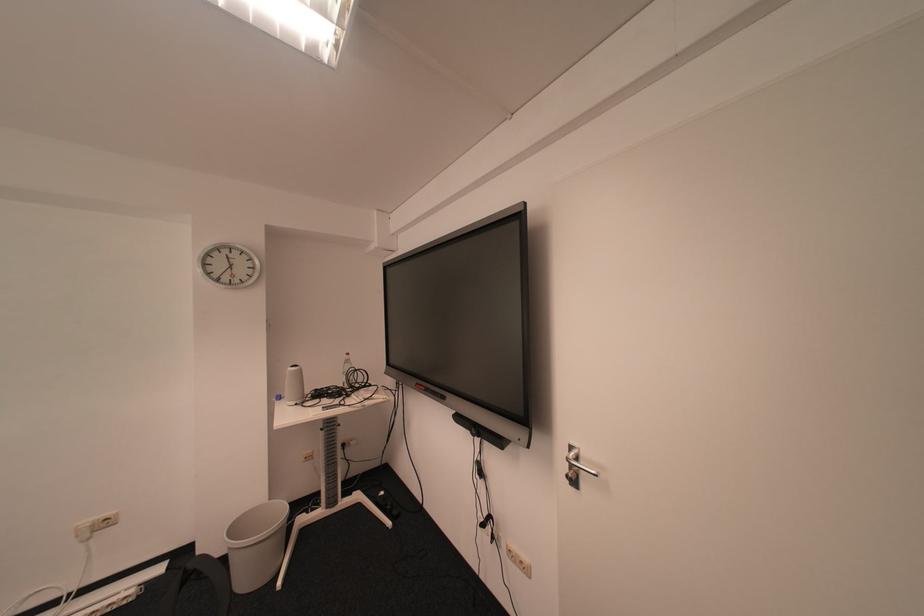
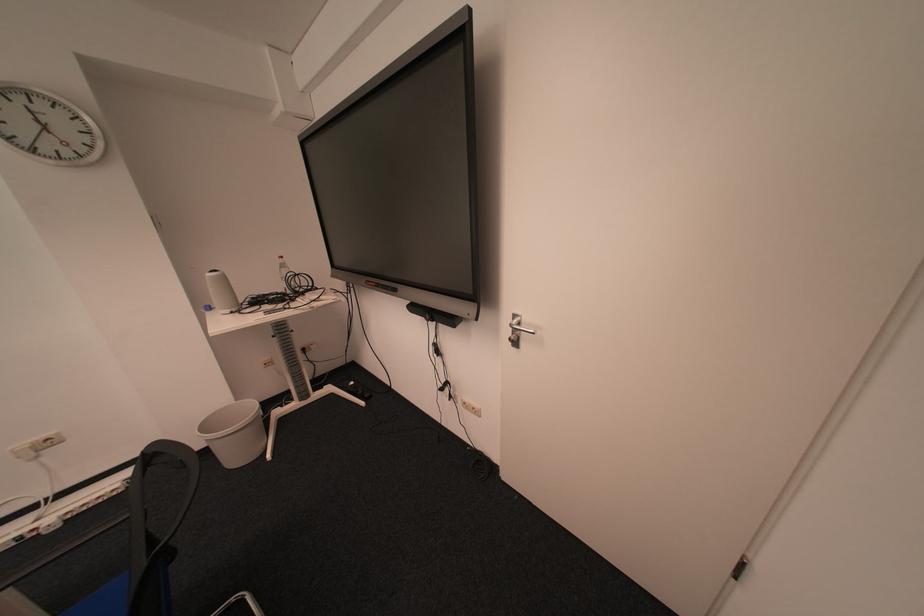
Locate, in the second image, the point that corresponds to point 582,466 in the first image.

(525, 330)